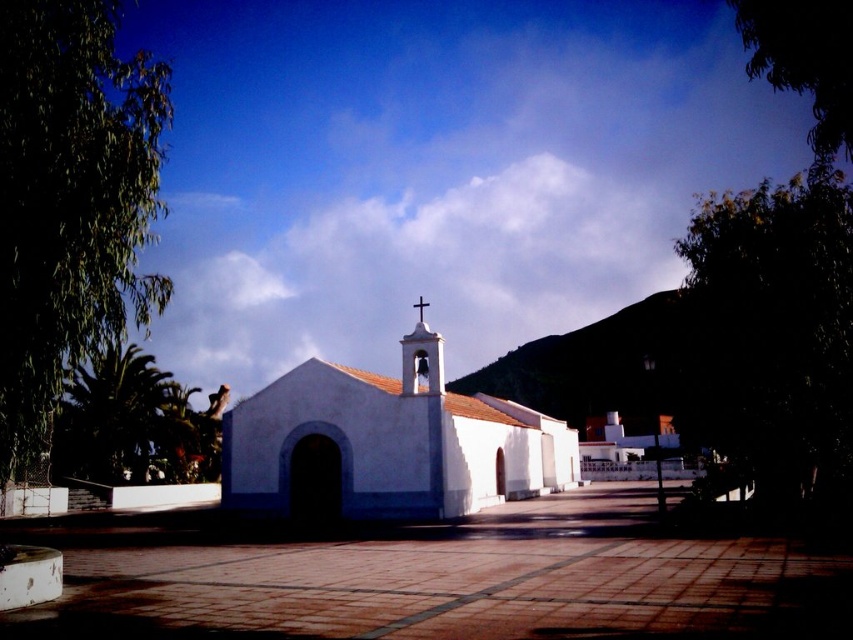
Question: Which point appears closest to the camera in this image?

Choices:
 (A) (421, 304)
 (B) (225, 433)

Answer: (A)

Question: Which of the following is the farthest from the observer?

Choices:
 (A) white wooden cross at center
 (B) white matte church at center

Answer: (A)

Question: Is white matte church at center thinner than white wooden cross at center?

Choices:
 (A) yes
 (B) no

Answer: (B)

Question: Which point is farther to the camera?

Choices:
 (A) white matte church at center
 (B) white wooden cross at center

Answer: (B)

Question: Does white matte church at center have a greater width compared to white wooden cross at center?

Choices:
 (A) yes
 (B) no

Answer: (A)

Question: Is white matte church at center to the right of white wooden cross at center from the viewer's perspective?

Choices:
 (A) yes
 (B) no

Answer: (A)